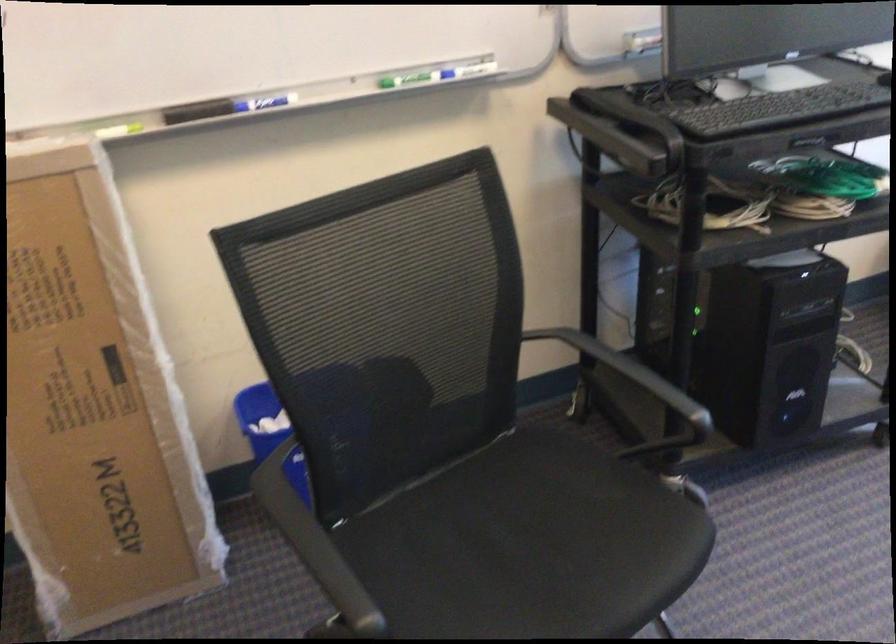
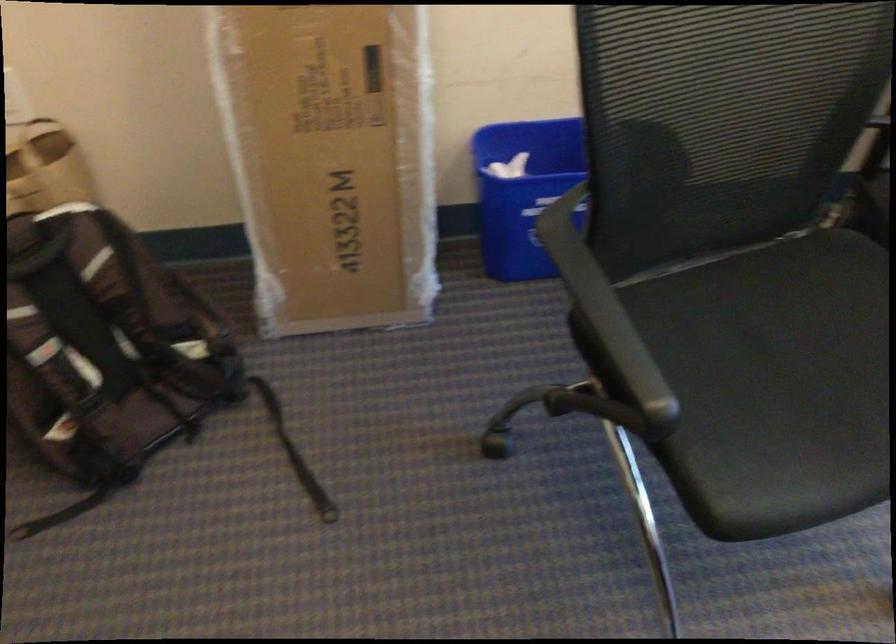
Question: Based on the continuous images, in which direction is the camera rotating? Reply with the corresponding letter.

Choices:
 (A) Left
 (B) Right
 (C) Up
 (D) Down

Answer: (D)